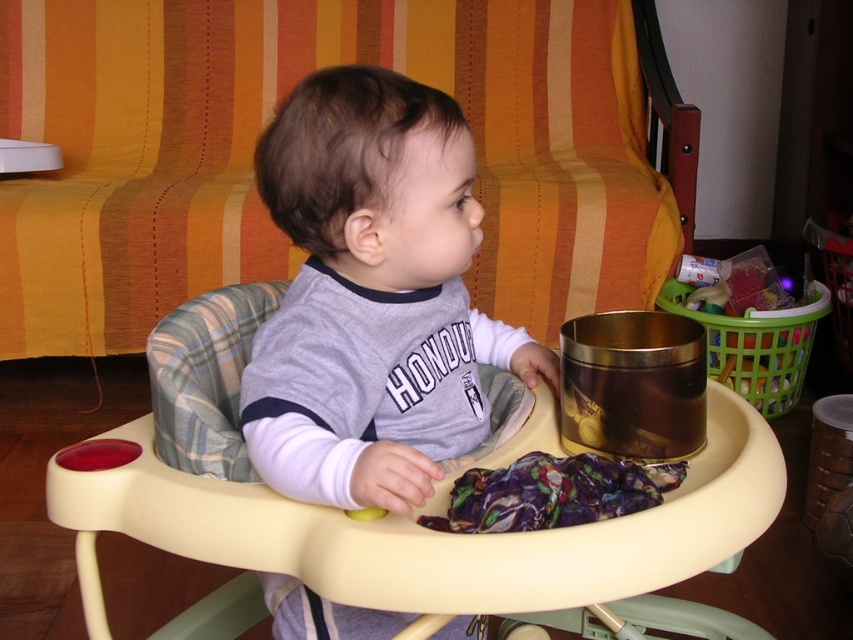
In the scene shown: You are a parent trying to place a pacifier between the gray cotton shirt at center and the purple fabric at center on your child high chair tray. The pacifier is 2 inches long. Do you think there is enough space between them to place the pacifier?

The gray cotton shirt at center is 8.71 inches away from the purple fabric at center. Since the pacifier is only 2 inches long, there is sufficient space between them to place the pacifier.

You are a parent trying to organize the items on the high chair tray. You need to place a spoon between the gray cotton shirt at center and the purple fabric at center. Where should you place the spoon?

The gray cotton shirt at center is to the left of the purple fabric at center, so you should place the spoon between them to the right of the gray cotton shirt at center and to the left of the purple fabric at center.

You are a parent trying to place a new toy on the tray of the beige plastic feeding chair at center. According to the coordinates provided, where exactly should you place the toy to ensure it is centered on the tray?

The beige plastic feeding chair at center is located at point (398,518), so placing the toy at those coordinates would center it on the tray.